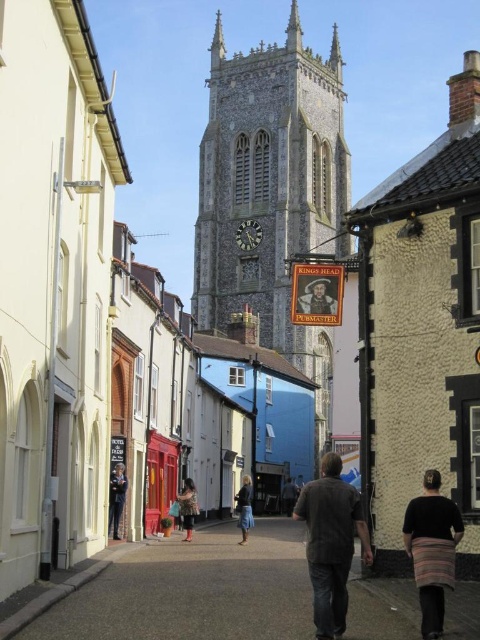
You are a delivery person carrying a package and need to navigate through the street. You see the smooth asphalt alley at center and the black knitwear at lower right. Which path is wider for your delivery cart?

The smooth asphalt alley at center is wider than the black knitwear at lower right, so the delivery cart should take the smooth asphalt alley at center path.

You are a delivery person standing at the entrance of the street. You need to place the black knitwear at lower right on top of the smooth asphalt alley at center. Is this possible given their sizes?

The smooth asphalt alley at center has a greater height compared to black knitwear at lower right. Therefore, the black knitwear at lower right can be placed on top of the smooth asphalt alley at center since it is shorter in height.

Looking at this image, you are standing on the street looking at the clock tower. There are two points marked in the image. One is at coordinates point (345, 614) and the other is at point (248, 490). Which of these points is closer to you?

The point at coordinates point (345, 614) is closer to you than the point at point (248, 490).